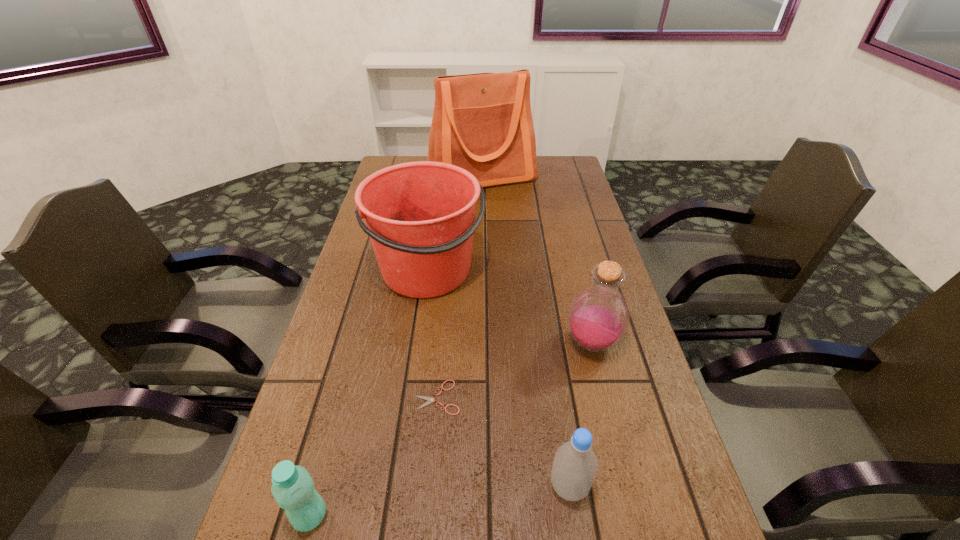
This screenshot has width=960, height=540. Find the location of `shopping bag`. shopping bag is located at coordinates (482, 122).

This screenshot has width=960, height=540. What are the coordinates of `the tallest object` in the screenshot? It's located at (482, 122).

Identify the location of bucket. (420, 216).

Identify the location of the third farthest object. pyautogui.click(x=598, y=317).

Locate an element on the screen. the farthest bottle is located at coordinates (598, 317).

Locate an element on the screen. Image resolution: width=960 pixels, height=540 pixels. the second bottle from left to right is located at coordinates (575, 465).

At what (x,y) coordinates should I click in order to perform the action: click on the leftmost bottle. Please return your answer as a coordinate pair (x, y). Looking at the image, I should click on (293, 489).

Find the location of a particular element. the third nearest object is located at coordinates (430, 399).

This screenshot has width=960, height=540. I want to click on shears, so click(x=430, y=399).

You are a GUI agent. You are given a task and a screenshot of the screen. Output one action in this format:
    pyautogui.click(x=<x>, y=<y>)
    Task: Click on the free space located on the left of the farthest object
    Image resolution: width=960 pixels, height=540 pixels.
    Given the screenshot: What is the action you would take?
    pyautogui.click(x=396, y=177)